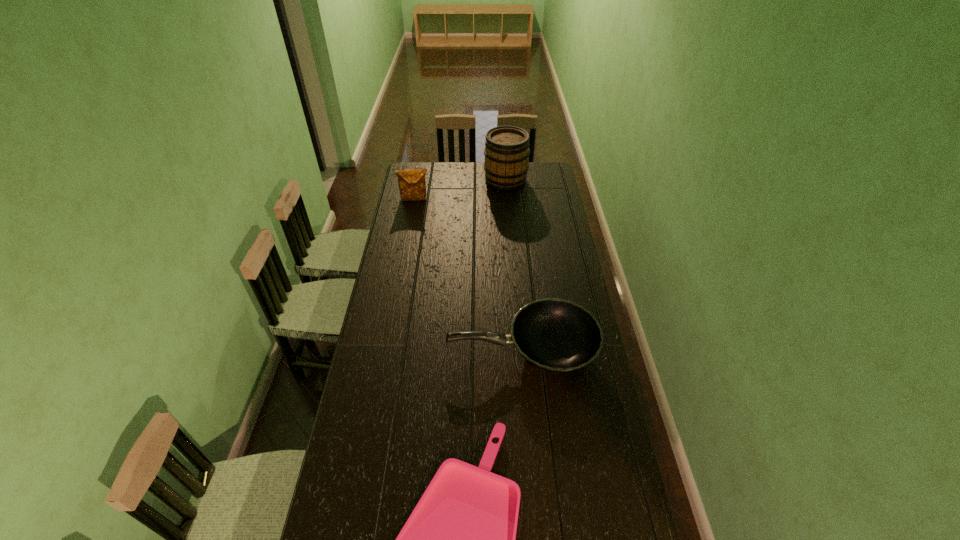
Where is `the closest object relative to the cider`? The width and height of the screenshot is (960, 540). the closest object relative to the cider is located at coordinates (412, 185).